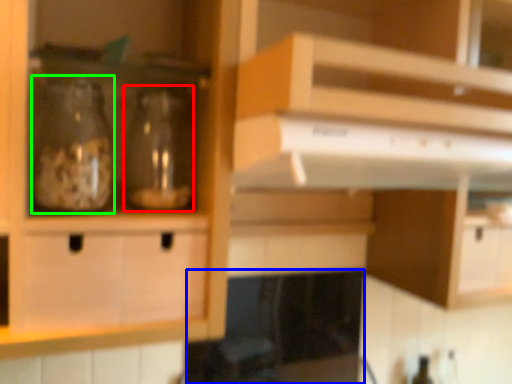
Question: Which is nearer to the glass bottle (highlighted by a red box)? appliance (highlighted by a blue box) or glass bottle (highlighted by a green box).

Choices:
 (A) appliance
 (B) glass bottle

Answer: (B)